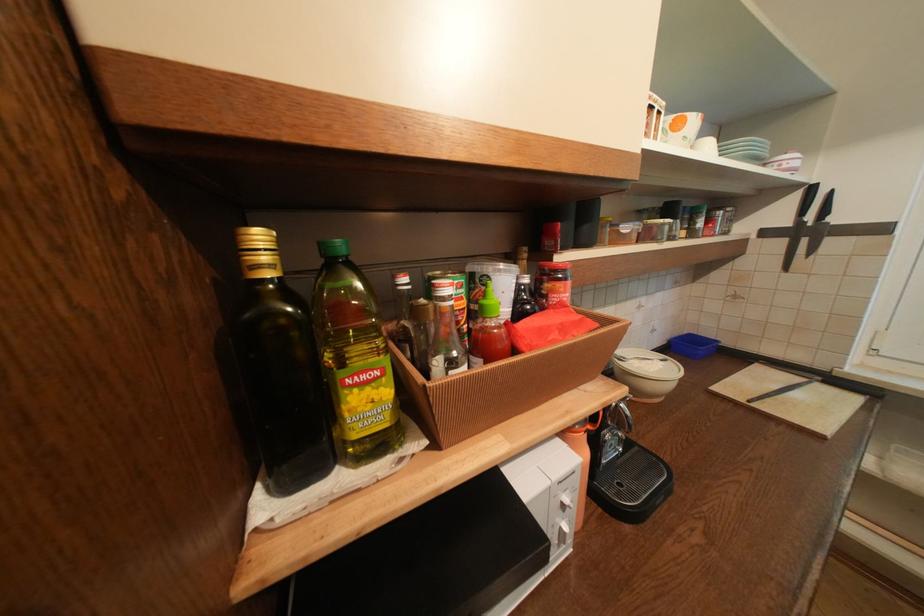
The height and width of the screenshot is (616, 924). Describe the element at coordinates (564, 516) in the screenshot. I see `the white microwave dial` at that location.